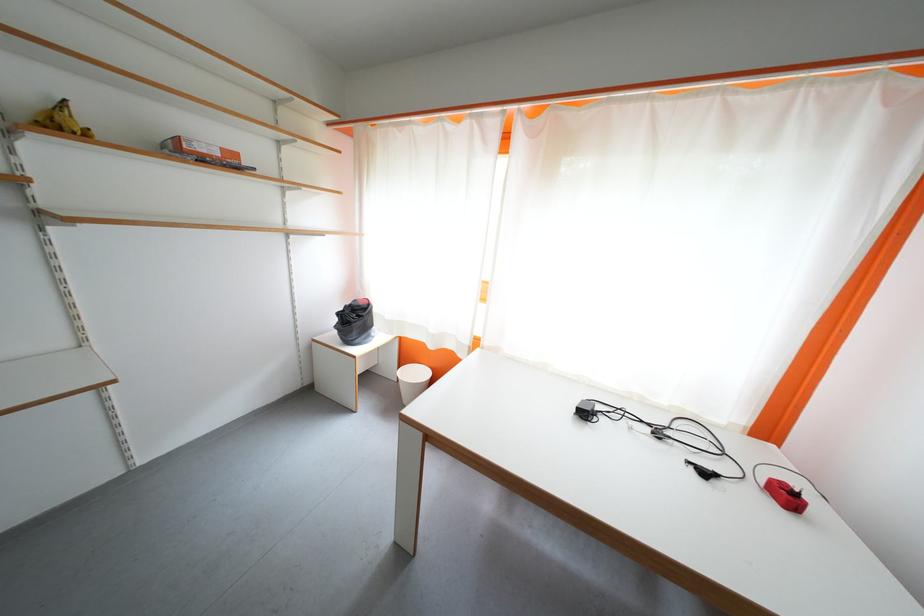
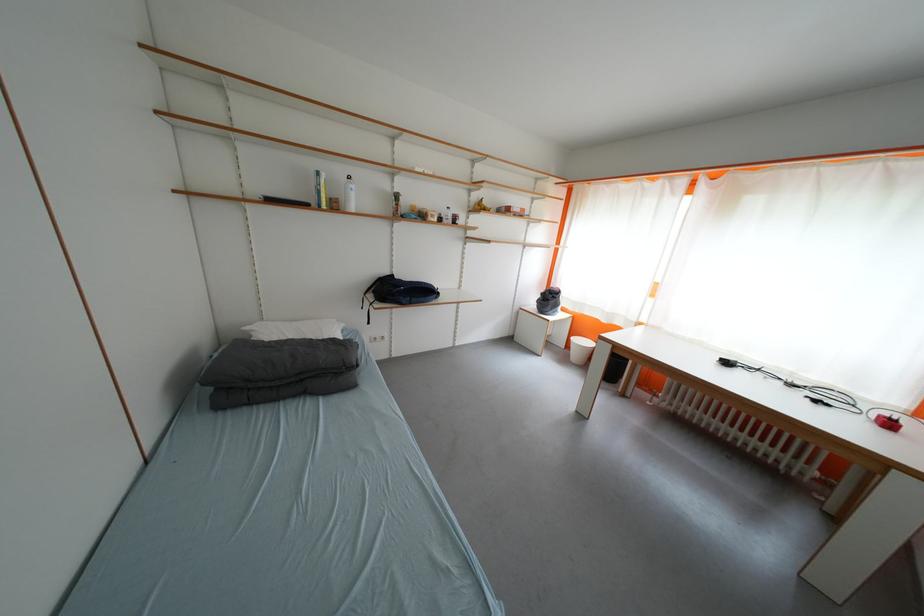
In the second image, find the point that corresponds to point (796, 500) in the first image.

(897, 428)